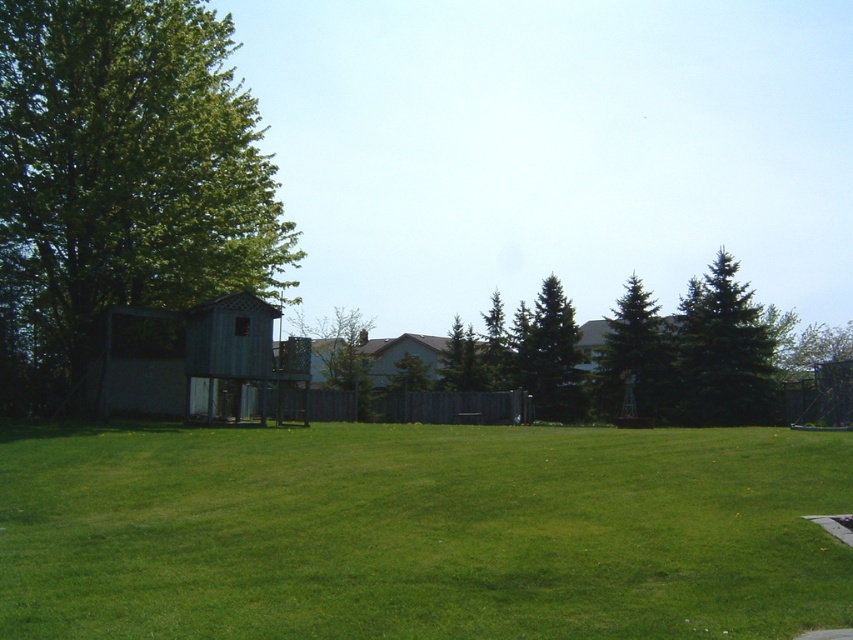
Question: Which object is farther from the camera taking this photo?

Choices:
 (A) green needle-like tree at right
 (B) green textured pine tree at center
 (C) green grass at center

Answer: (B)

Question: Can you confirm if green grass at center is positioned to the right of green needle-like tree at right?

Choices:
 (A) yes
 (B) no

Answer: (B)

Question: Does green leafy tree at left come in front of green fir tree at center?

Choices:
 (A) yes
 (B) no

Answer: (A)

Question: Based on their relative distances, which object is nearer to the green grass at center?

Choices:
 (A) green fir tree at center
 (B) green textured pine tree at center
 (C) green needle-like tree at right
 (D) green leafy tree at left

Answer: (D)

Question: Is green grass at center bigger than green leafy tree at left?

Choices:
 (A) yes
 (B) no

Answer: (B)

Question: Estimate the real-world distances between objects in this image. Which object is closer to the green grass at center?

Choices:
 (A) green leafy tree at left
 (B) green fir tree at center

Answer: (A)